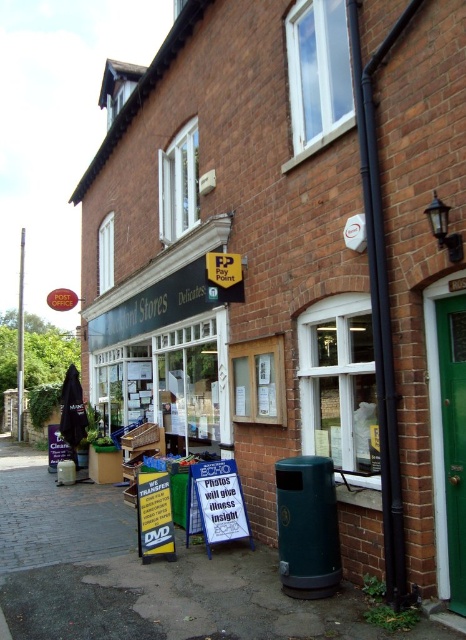
Question: Can you confirm if concrete pavement at lower left is positioned below black plastic pipe at upper right?

Choices:
 (A) no
 (B) yes

Answer: (B)

Question: Which object is positioned closest to the black plastic pipe at upper right?

Choices:
 (A) concrete pavement at lower left
 (B) green metallic pole at left

Answer: (A)

Question: Is black plastic pipe at upper right smaller than green metallic pole at left?

Choices:
 (A) no
 (B) yes

Answer: (B)

Question: Does concrete pavement at lower left lie behind green metallic pole at left?

Choices:
 (A) yes
 (B) no

Answer: (B)

Question: Which point appears farthest from the camera in this image?

Choices:
 (A) (260, 560)
 (B) (21, 232)

Answer: (B)

Question: Which is nearer to the green metallic pole at left?

Choices:
 (A) black plastic pipe at upper right
 (B) concrete pavement at lower left

Answer: (B)